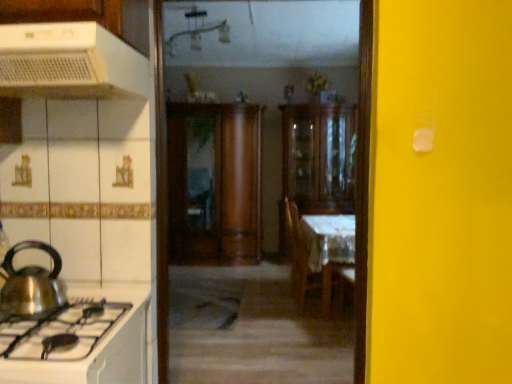
Describe the element at coordinates (69, 62) in the screenshot. I see `white plastic range hood at upper left, marked as the first kitchen appliance in a top-to-bottom arrangement` at that location.

In order to face wooden cabinet at center, which ranks as the second cabinetry in left-to-right order, should I rotate leftwards or rightwards?

You should rotate right by 7.744 degrees.

In order to face white cloth-covered table at center, should I rotate leftwards or rightwards?

You should look right and rotate roughly 8.155 degrees.

At what (x,y) coordinates should I click in order to perform the action: click on white glossy stove at lower left. Please return your answer as a coordinate pair (x, y). The height and width of the screenshot is (384, 512). Looking at the image, I should click on (97, 345).

The width and height of the screenshot is (512, 384). Describe the element at coordinates (97, 345) in the screenshot. I see `white glossy stove at lower left` at that location.

Locate an element on the screen. This screenshot has width=512, height=384. white plastic range hood at upper left, the 2th kitchen appliance positioned from the bottom is located at coordinates (69, 62).

Is wooden chair at center spatially inside white cloth-covered table at center, or outside of it?

wooden chair at center is not enclosed by white cloth-covered table at center.

Considering the sizes of wooden chair at center and white cloth-covered table at center in the image, is wooden chair at center wider or thinner than white cloth-covered table at center?

Considering their sizes, wooden chair at center looks slimmer than white cloth-covered table at center.

How distant is wooden chair at center from white cloth-covered table at center?

wooden chair at center is 84.20 centimeters from white cloth-covered table at center.

Is wooden chair at center directly adjacent to white cloth-covered table at center?

wooden chair at center and white cloth-covered table at center are not in contact.

How many degrees apart are the facing directions of white plastic range hood at upper left, the 2th kitchen appliance positioned from the bottom, and wooden chair at center?

white plastic range hood at upper left, the 2th kitchen appliance positioned from the bottom, and wooden chair at center are facing 90 degrees away from each other.

Is white plastic range hood at upper left, marked as the first kitchen appliance in a top-to-bottom arrangement, wider than wooden chair at center?

Correct, the width of white plastic range hood at upper left, marked as the first kitchen appliance in a top-to-bottom arrangement, exceeds that of wooden chair at center.

From a real-world perspective, which kitchen appliance is the 2nd one above the wooden chair at center? Please provide its 2D coordinates.

[(69, 62)]

Could wooden chair at center be considered to be inside white plastic range hood at upper left, the 2th kitchen appliance positioned from the bottom?

No.

Relative to white glossy stove at lower left, is white cloth-covered table at center in front or behind?

white cloth-covered table at center is behind white glossy stove at lower left.

Which point is more forward, (354, 243) or (111, 295)?

The point (111, 295) is in front.

From a real-world perspective, which is physically above, white cloth-covered table at center or white glossy stove at lower left?

white glossy stove at lower left.

Can you confirm if white cloth-covered table at center is thinner than white glossy stove at lower left?

Yes.

Is white cloth-covered table at center turned away from shiny metallic kettle at left, marked as the second kitchen appliance in a top-to-bottom arrangement?

No, white cloth-covered table at center's orientation is not away from shiny metallic kettle at left, marked as the second kitchen appliance in a top-to-bottom arrangement.

Is white cloth-covered table at center bigger or smaller than shiny metallic kettle at left, the first kitchen appliance when ordered from bottom to top?

Clearly, white cloth-covered table at center is larger in size than shiny metallic kettle at left, the first kitchen appliance when ordered from bottom to top.

Relative to shiny metallic kettle at left, marked as the second kitchen appliance in a top-to-bottom arrangement, is white cloth-covered table at center in front or behind?

In the image, white cloth-covered table at center appears behind shiny metallic kettle at left, marked as the second kitchen appliance in a top-to-bottom arrangement.

From a real-world perspective, is white cloth-covered table at center physically located above or below shiny metallic kettle at left, marked as the second kitchen appliance in a top-to-bottom arrangement?

In terms of real-world spatial position, white cloth-covered table at center is below shiny metallic kettle at left, marked as the second kitchen appliance in a top-to-bottom arrangement.

Is wooden cabinet at center, which ranks as the second cabinetry in left-to-right order, wider or thinner than white glossy stove at lower left?

Considering their sizes, wooden cabinet at center, which ranks as the second cabinetry in left-to-right order, looks slimmer than white glossy stove at lower left.

Considering the positions of objects wooden cabinet at center, which ranks as the second cabinetry in left-to-right order, and white glossy stove at lower left in the image provided, who is behind, wooden cabinet at center, which ranks as the second cabinetry in left-to-right order, or white glossy stove at lower left?

wooden cabinet at center, which ranks as the second cabinetry in left-to-right order, is further from the camera.

Which is in front, point (302, 209) or point (113, 286)?

Positioned in front is point (113, 286).

Is wooden cabinet at center, marked as the 1th cabinetry in a right-to-left arrangement, not close to white glossy stove at lower left?

That's right, there is a large distance between wooden cabinet at center, marked as the 1th cabinetry in a right-to-left arrangement, and white glossy stove at lower left.

Is point (73, 87) in front of point (341, 108)?

That is True.

What's the angular difference between white plastic range hood at upper left, marked as the first kitchen appliance in a top-to-bottom arrangement, and wooden cabinet at center, marked as the 1th cabinetry in a right-to-left arrangement,'s facing directions?

The angle between the facing direction of white plastic range hood at upper left, marked as the first kitchen appliance in a top-to-bottom arrangement, and the facing direction of wooden cabinet at center, marked as the 1th cabinetry in a right-to-left arrangement, is 0.000558 degrees.

Is white plastic range hood at upper left, marked as the first kitchen appliance in a top-to-bottom arrangement, positioned with its back to wooden cabinet at center, which ranks as the second cabinetry in left-to-right order?

That's right, white plastic range hood at upper left, marked as the first kitchen appliance in a top-to-bottom arrangement, is facing away from wooden cabinet at center, which ranks as the second cabinetry in left-to-right order.

Is white plastic range hood at upper left, the 2th kitchen appliance positioned from the bottom, taller than wooden cabinet at center, which ranks as the second cabinetry in left-to-right order?

Incorrect, the height of white plastic range hood at upper left, the 2th kitchen appliance positioned from the bottom, is not larger of that of wooden cabinet at center, which ranks as the second cabinetry in left-to-right order.

From the picture: Measure the distance between white glossy stove at lower left and white plastic range hood at upper left, marked as the first kitchen appliance in a top-to-bottom arrangement.

white glossy stove at lower left is 32.25 inches away from white plastic range hood at upper left, marked as the first kitchen appliance in a top-to-bottom arrangement.

Does white glossy stove at lower left have a lesser height compared to white plastic range hood at upper left, marked as the first kitchen appliance in a top-to-bottom arrangement?

No.

Is white glossy stove at lower left situated inside white plastic range hood at upper left, the 2th kitchen appliance positioned from the bottom, or outside?

The correct answer is: outside.

Which object is wider, white glossy stove at lower left or white plastic range hood at upper left, the 2th kitchen appliance positioned from the bottom?

white glossy stove at lower left is wider.

Locate an element on the screen. The height and width of the screenshot is (384, 512). chair above the white cloth-covered table at center (from the image's perspective) is located at coordinates (296, 251).

Identify the location of kitchen appliance that is the 1st one when counting leftward from the wooden chair at center. This screenshot has height=384, width=512. (69, 62).

When comparing their distances from white plastic range hood at upper left, marked as the first kitchen appliance in a top-to-bottom arrangement, does shiny metallic kettle at left, marked as the second kitchen appliance in a top-to-bottom arrangement, or wooden cabinet at center, the first cabinetry in the left-to-right sequence, seem further?

wooden cabinet at center, the first cabinetry in the left-to-right sequence.

When comparing their distances from white cloth-covered table at center, does wooden cabinet at center, the first cabinetry in the left-to-right sequence, or white glossy stove at lower left seem further?

Based on the image, white glossy stove at lower left appears to be further to white cloth-covered table at center.

Which object lies further to the anchor point shiny metallic kettle at left, the first kitchen appliance when ordered from bottom to top, wooden cabinet at center, the first cabinetry in the left-to-right sequence, or wooden chair at center?

wooden cabinet at center, the first cabinetry in the left-to-right sequence, is positioned further to the anchor shiny metallic kettle at left, the first kitchen appliance when ordered from bottom to top.

When comparing their distances from shiny metallic kettle at left, the first kitchen appliance when ordered from bottom to top, does white glossy stove at lower left or wooden chair at center seem further?

wooden chair at center is further to shiny metallic kettle at left, the first kitchen appliance when ordered from bottom to top.

Based on their spatial positions, is shiny metallic kettle at left, the first kitchen appliance when ordered from bottom to top, or wooden cabinet at center, which ranks as the second cabinetry in left-to-right order, closer to wooden chair at center?

The object closer to wooden chair at center is wooden cabinet at center, which ranks as the second cabinetry in left-to-right order.

Estimate the real-world distances between objects in this image. Which object is closer to white plastic range hood at upper left, marked as the first kitchen appliance in a top-to-bottom arrangement, white glossy stove at lower left or white cloth-covered table at center?

white glossy stove at lower left is positioned closer to the anchor white plastic range hood at upper left, marked as the first kitchen appliance in a top-to-bottom arrangement.

Looking at the image, which one is located closer to wooden cabinet at center, the first cabinetry in the left-to-right sequence, wooden cabinet at center, marked as the 1th cabinetry in a right-to-left arrangement, or white glossy stove at lower left?

wooden cabinet at center, marked as the 1th cabinetry in a right-to-left arrangement, is positioned closer to the anchor wooden cabinet at center, the first cabinetry in the left-to-right sequence.

When comparing their distances from shiny metallic kettle at left, the first kitchen appliance when ordered from bottom to top, does white plastic range hood at upper left, marked as the first kitchen appliance in a top-to-bottom arrangement, or wooden cabinet at center, which ranks as the second cabinetry in left-to-right order, seem further?

Among the two, wooden cabinet at center, which ranks as the second cabinetry in left-to-right order, is located further to shiny metallic kettle at left, the first kitchen appliance when ordered from bottom to top.

You are a GUI agent. You are given a task and a screenshot of the screen. Output one action in this format:
    pyautogui.click(x=<x>, y=<y>)
    Task: Click on the chair between white plastic range hood at upper left, marked as the first kitchen appliance in a top-to-bottom arrangement, and wooden cabinet at center, marked as the 1th cabinetry in a right-to-left arrangement, in the front-back direction
    
    Given the screenshot: What is the action you would take?
    tap(296, 251)

The height and width of the screenshot is (384, 512). I want to click on chair between white glossy stove at lower left and wooden cabinet at center, the second cabinetry in the right-to-left sequence, in the front-back direction, so click(x=296, y=251).

Find the location of `chair between shiny metallic kettle at left, the first kitchen appliance when ordered from bottom to top, and wooden cabinet at center, which ranks as the second cabinetry in left-to-right order, in the front-back direction`. chair between shiny metallic kettle at left, the first kitchen appliance when ordered from bottom to top, and wooden cabinet at center, which ranks as the second cabinetry in left-to-right order, in the front-back direction is located at coordinates (296, 251).

Image resolution: width=512 pixels, height=384 pixels. Identify the location of cabinetry between wooden chair at center and wooden cabinet at center, which ranks as the second cabinetry in left-to-right order, in the front-back direction. (215, 182).